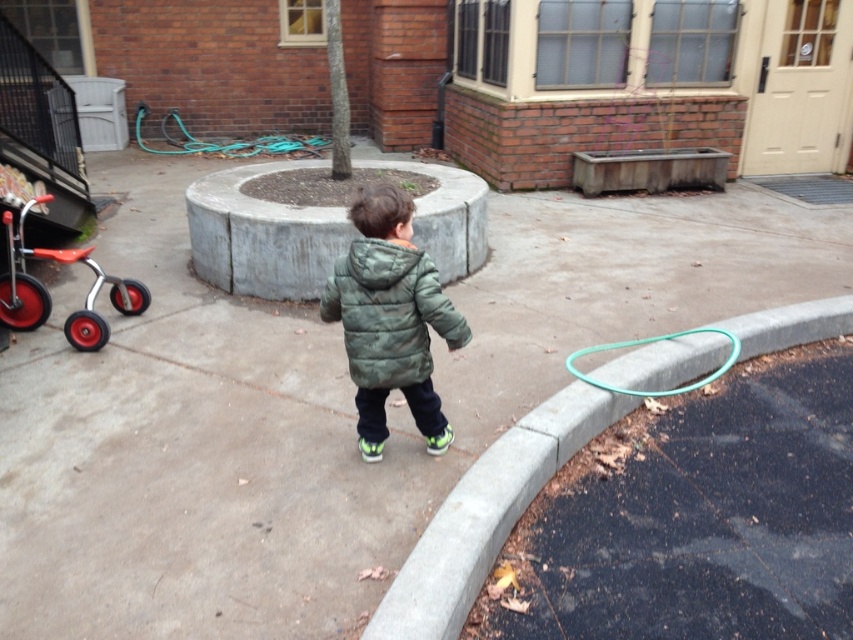
Question: Considering the relative positions of red rubber baby carriage at left and green rubber garden hose at lower right in the image provided, where is red rubber baby carriage at left located with respect to green rubber garden hose at lower right?

Choices:
 (A) right
 (B) left

Answer: (B)

Question: Which point is farther to the camera?

Choices:
 (A) (134, 136)
 (B) (567, 369)
 (C) (646, 371)
 (D) (434, 291)

Answer: (A)

Question: Which object appears farthest from the camera in this image?

Choices:
 (A) green rubber garden hose at lower right
 (B) green quilted jacket at center

Answer: (A)

Question: Is gray concrete curb at lower right behind green rubber garden hose at lower left?

Choices:
 (A) yes
 (B) no

Answer: (B)

Question: Among these objects, which one is farthest from the camera?

Choices:
 (A) red rubber baby carriage at left
 (B) green rubber garden hose at lower left

Answer: (B)

Question: Is gray concrete curb at lower right thinner than green rubber garden hose at lower right?

Choices:
 (A) yes
 (B) no

Answer: (B)